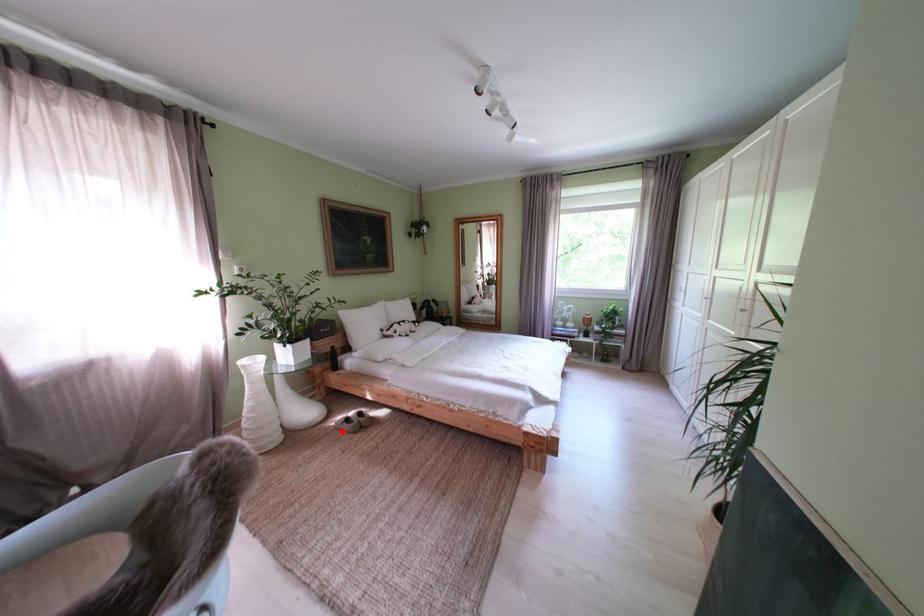
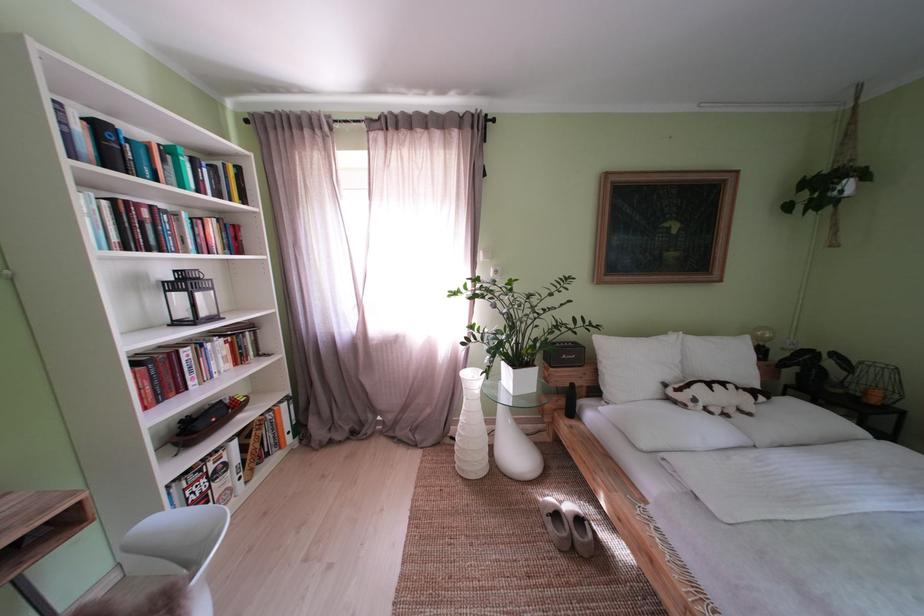
The point at the highlighted location is marked in the first image. Where is the corresponding point in the second image?

(546, 506)